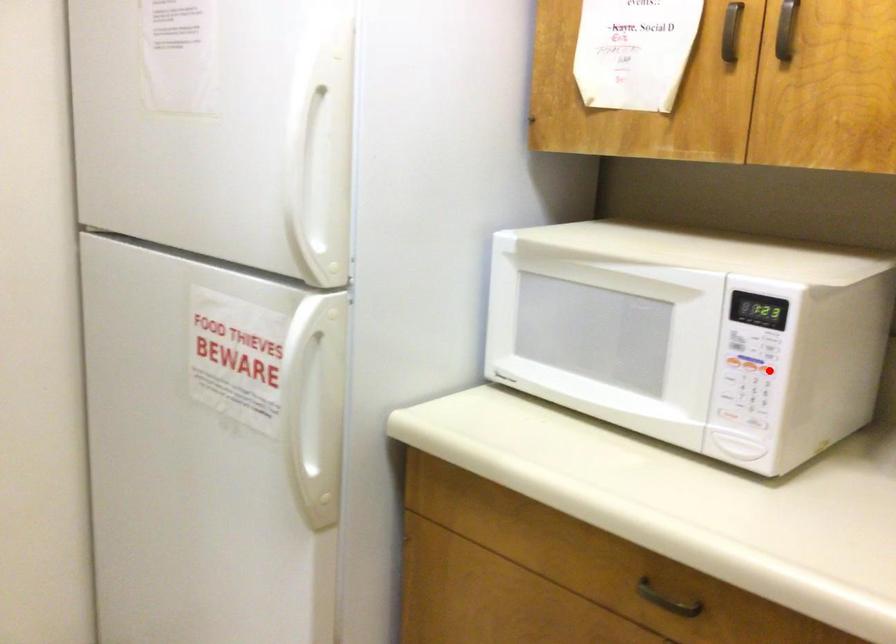
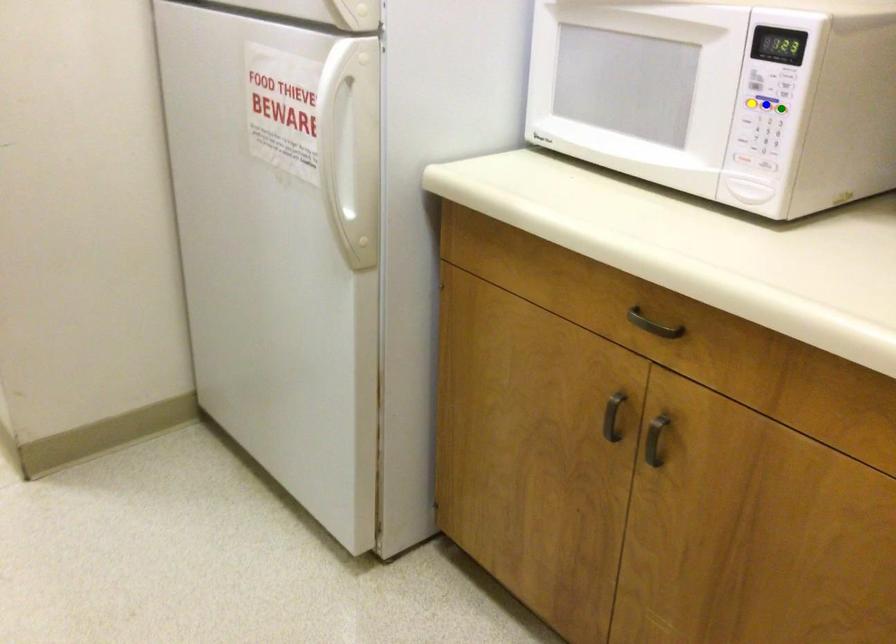
Question: I am providing you with two images of the same scene from different viewpoints. A red point is marked on the first image. You are given multiple points on the second image. Which point in image 2 is actually the same real-world point as the red point in image 1?

Choices:
 (A) blue point
 (B) green point
 (C) yellow point

Answer: (B)